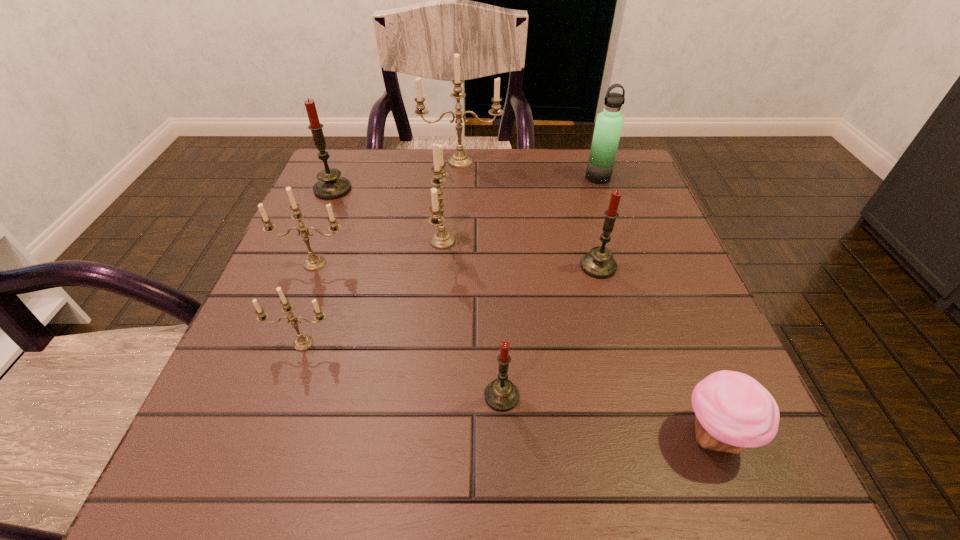
Where is `object present at the far right corner`? This screenshot has width=960, height=540. object present at the far right corner is located at coordinates (609, 123).

What are the coordinates of `object situated at the near right corner` in the screenshot? It's located at (733, 411).

In the image, there is a desktop. Find the location of `free space at the far edge`. free space at the far edge is located at coordinates (554, 171).

Locate an element on the screen. free space at the near edge is located at coordinates (646, 458).

This screenshot has height=540, width=960. In order to click on vacant space at the left edge of the desktop in this screenshot , I will do `click(343, 322)`.

Where is `vacant space at the right edge`? Image resolution: width=960 pixels, height=540 pixels. vacant space at the right edge is located at coordinates (670, 268).

Locate an element on the screen. free space at the far left corner of the desktop is located at coordinates (348, 200).

I want to click on vacant space at the near left corner of the desktop, so click(x=274, y=455).

Locate an element on the screen. vacant space at the far right corner is located at coordinates (614, 179).

This screenshot has height=540, width=960. Identify the location of vacant point at the near right corner. (669, 469).